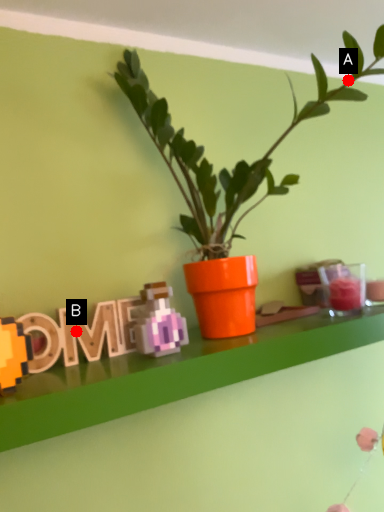
Question: Two points are circled on the image, labeled by A and B beside each circle. Which point appears closest to the camera in this image?

Choices:
 (A) A is closer
 (B) B is closer

Answer: (B)